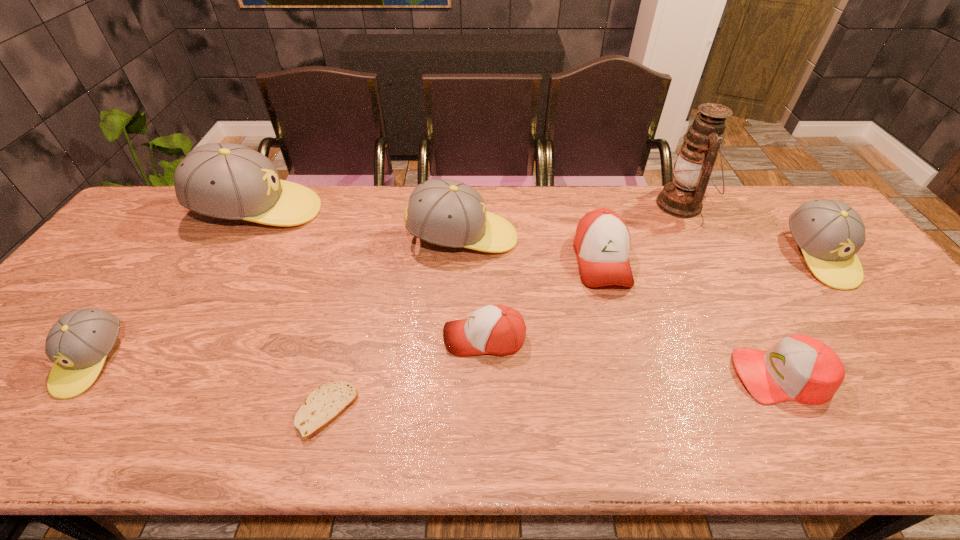
This screenshot has height=540, width=960. In order to click on the left orange baseball cap in this screenshot , I will do `click(494, 329)`.

The height and width of the screenshot is (540, 960). Identify the location of the smaller orange baseball cap. (494, 329).

The height and width of the screenshot is (540, 960). Find the location of `the sixth baseball cap from left to right`. the sixth baseball cap from left to right is located at coordinates (800, 368).

The width and height of the screenshot is (960, 540). I want to click on pita bread, so click(x=324, y=405).

This screenshot has width=960, height=540. Identify the location of the shortest object. (324, 405).

Identify the location of free space located 0.150m on the right of the tallest object. (752, 205).

Identify the location of vacant space located on the front-facing side of the tallest baseball cap. (417, 211).

Find the location of a particular element. The width and height of the screenshot is (960, 540). vacant space situated on the front-facing side of the third yellow baseball cap from left to right is located at coordinates (570, 238).

Find the location of a particular element. The width and height of the screenshot is (960, 540). vacant space positioned on the front-facing side of the rightmost object is located at coordinates (914, 379).

Where is `vacant region located 0.240m on the front-facing side of the fourth object from right to left`? The image size is (960, 540). vacant region located 0.240m on the front-facing side of the fourth object from right to left is located at coordinates (633, 375).